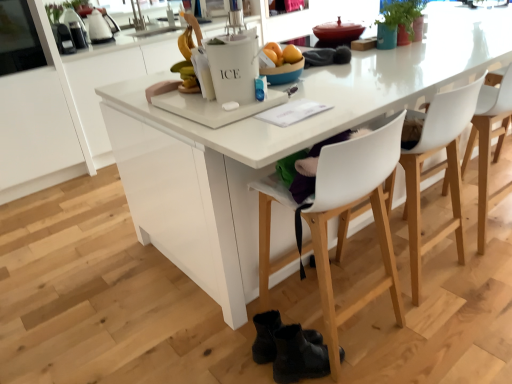
Describe the element at coordinates (233, 66) in the screenshot. I see `white plastic ice bucket at center` at that location.

The height and width of the screenshot is (384, 512). What do you see at coordinates (298, 356) in the screenshot?
I see `black leather boots at lower center, marked as the 2th footwear in a back-to-front arrangement` at bounding box center [298, 356].

In order to face black leather boots at lower center, acting as the first footwear starting from the back, should I rotate leftwards or rightwards?

You should rotate right by 3.871 degrees.

Locate an element on the screen. transparent glass window at upper left is located at coordinates (18, 38).

At what (x,y) coordinates should I click in order to perform the action: click on white plastic ice bucket at center. Please return your answer as a coordinate pair (x, y). Looking at the image, I should click on (233, 66).

Which is more to the right, black leather boots at lower center, marked as the 2th footwear in a back-to-front arrangement, or green matte plant at upper right?

Positioned to the right is green matte plant at upper right.

Looking at the image, does black leather boots at lower center, which is the 1th footwear from front to back, seem bigger or smaller compared to green matte plant at upper right?

black leather boots at lower center, which is the 1th footwear from front to back, is bigger than green matte plant at upper right.

Find the location of `plant above the black leather boots at lower center, which is the 1th footwear from front to back (from a real-world perspective)`. plant above the black leather boots at lower center, which is the 1th footwear from front to back (from a real-world perspective) is located at coordinates (403, 18).

Based on the photo, could you measure the distance between white plastic ice bucket at center and black leather boots at lower center, acting as the first footwear starting from the back?

They are 35.16 inches apart.

Would you say black leather boots at lower center, which is the 2th footwear from front to back, is part of white plastic ice bucket at center's contents?

No, black leather boots at lower center, which is the 2th footwear from front to back, is not inside white plastic ice bucket at center.

From the image's perspective, which is below, white plastic ice bucket at center or black leather boots at lower center, acting as the first footwear starting from the back?

From the image's view, black leather boots at lower center, acting as the first footwear starting from the back, is below.

Is white plastic ice bucket at center facing away from black leather boots at lower center, which is the 2th footwear from front to back?

No, white plastic ice bucket at center is not facing away from black leather boots at lower center, which is the 2th footwear from front to back.

From the image's perspective, does black leather boots at lower center, which is the 1th footwear from front to back, appear lower than black leather boots at lower center, which is the 2th footwear from front to back?

Yes.

Considering the relative positions of black leather boots at lower center, marked as the 2th footwear in a back-to-front arrangement, and black leather boots at lower center, acting as the first footwear starting from the back, in the image provided, is black leather boots at lower center, marked as the 2th footwear in a back-to-front arrangement, in front of black leather boots at lower center, acting as the first footwear starting from the back,?

Yes, it is in front of black leather boots at lower center, acting as the first footwear starting from the back.

Which object is positioned more to the right, black leather boots at lower center, which is the 1th footwear from front to back, or black leather boots at lower center, acting as the first footwear starting from the back?

black leather boots at lower center, which is the 1th footwear from front to back, is more to the right.

Does white plastic chair at right, which is the first chair from right to left, have a lesser height compared to black leather boots at lower center, acting as the first footwear starting from the back?

Incorrect, the height of white plastic chair at right, which is the first chair from right to left, does not fall short of that of black leather boots at lower center, acting as the first footwear starting from the back.

Is white plastic chair at right, which is the first chair from right to left, inside or outside of black leather boots at lower center, acting as the first footwear starting from the back?

white plastic chair at right, which is the first chair from right to left, is located beyond the bounds of black leather boots at lower center, acting as the first footwear starting from the back.

Is white plastic chair at right, which is the first chair from right to left, oriented away from black leather boots at lower center, acting as the first footwear starting from the back?

No, black leather boots at lower center, acting as the first footwear starting from the back, is not at the back of white plastic chair at right, which is the first chair from right to left.

Is white plastic chair at right, which is the first chair from right to left, further to camera compared to black leather boots at lower center, acting as the first footwear starting from the back?

Yes, white plastic chair at right, which is the first chair from right to left, is further from the viewer.

Does point (6, 26) lie behind point (252, 54)?

Yes, it is.

Is transparent glass window at upper left oriented away from white plastic ice bucket at center?

No, transparent glass window at upper left is not facing the opposite direction of white plastic ice bucket at center.

From the image's perspective, is transparent glass window at upper left on white plastic ice bucket at center?

Correct, transparent glass window at upper left appears higher than white plastic ice bucket at center in the image.

Which object is closer to the camera, white plastic chair at center, the 2th chair viewed from the left, or white plastic chair at right, which is the first chair from right to left?

white plastic chair at center, the 2th chair viewed from the left, is in front.

Can you tell me how much white plastic chair at center, the 2th chair viewed from the left, and white plastic chair at right, which is the first chair from right to left, differ in facing direction?

They differ by 1.85 degrees in their facing directions.

From a real-world perspective, which object stands above the other?

white plastic chair at right, acting as the third chair starting from the left, from a real-world perspective.

Can you confirm if black leather boots at lower center, which is the 1th footwear from front to back, is taller than transparent glass window at upper left?

In fact, black leather boots at lower center, which is the 1th footwear from front to back, may be shorter than transparent glass window at upper left.

Is black leather boots at lower center, which is the 1th footwear from front to back, at the left side of transparent glass window at upper left?

In fact, black leather boots at lower center, which is the 1th footwear from front to back, is to the right of transparent glass window at upper left.

Is black leather boots at lower center, marked as the 2th footwear in a back-to-front arrangement, touching transparent glass window at upper left?

They are not placed beside each other.

Identify the location of the 2nd footwear below the green matte plant at upper right (from the image's perspective). (298, 356).

Locate an element on the screen. The width and height of the screenshot is (512, 384). the 2nd footwear behind the white plastic ice bucket at center, counting from the anchor's position is located at coordinates (266, 336).

Which object lies nearer to the anchor point black leather boots at lower center, which is the 2th footwear from front to back, white plastic chair at center, which is counted as the 3th chair, starting from the right, or white plastic ice bucket at center?

white plastic chair at center, which is counted as the 3th chair, starting from the right, lies closer to black leather boots at lower center, which is the 2th footwear from front to back, than the other object.

Looking at this image, from the image, which object appears to be farther from black leather boots at lower center, which is the 1th footwear from front to back, transparent glass window at upper left or white plastic ice bucket at center?

transparent glass window at upper left lies further to black leather boots at lower center, which is the 1th footwear from front to back, than the other object.

Considering their positions, is black leather boots at lower center, acting as the first footwear starting from the back, positioned closer to white plastic chair at center, the 2th chair viewed from the left, than green matte plant at upper right?

The object closer to white plastic chair at center, the 2th chair viewed from the left, is black leather boots at lower center, acting as the first footwear starting from the back.

Estimate the real-world distances between objects in this image. Which object is closer to black leather boots at lower center, which is the 1th footwear from front to back, white plastic chair at center, which is counted as the 3th chair, starting from the right, or white plastic chair at right, which is the first chair from right to left?

Among the two, white plastic chair at center, which is counted as the 3th chair, starting from the right, is located nearer to black leather boots at lower center, which is the 1th footwear from front to back.

When comparing their distances from green matte plant at upper right, does white plastic chair at center, which is the 1th chair in left-to-right order, or transparent glass window at upper left seem closer?

Based on the image, white plastic chair at center, which is the 1th chair in left-to-right order, appears to be nearer to green matte plant at upper right.

Looking at the image, which one is located further to black leather boots at lower center, acting as the first footwear starting from the back, white plastic ice bucket at center or green matte plant at upper right?

Based on the image, green matte plant at upper right appears to be further to black leather boots at lower center, acting as the first footwear starting from the back.

When comparing their distances from black leather boots at lower center, marked as the 2th footwear in a back-to-front arrangement, does transparent glass window at upper left or white plastic chair at center, which is counted as the 3th chair, starting from the right, seem further?

The object further to black leather boots at lower center, marked as the 2th footwear in a back-to-front arrangement, is transparent glass window at upper left.

When comparing their distances from white plastic ice bucket at center, does black leather boots at lower center, marked as the 2th footwear in a back-to-front arrangement, or green matte plant at upper right seem further?

green matte plant at upper right is positioned further to the anchor white plastic ice bucket at center.

Identify the location of footwear between black leather boots at lower center, acting as the first footwear starting from the back, and white plastic chair at right, acting as the third chair starting from the left, in the horizontal direction. (298, 356).

Identify the location of appliance between transparent glass window at upper left and white plastic chair at center, the 2th chair viewed from the left, in the horizontal direction. (233, 66).

Locate an element on the screen. chair situated between transparent glass window at upper left and white plastic chair at center, the 2th chair viewed from the left, from left to right is located at coordinates (348, 218).

Find the location of a particular element. chair between white plastic chair at center, the 2th chair viewed from the left, and black leather boots at lower center, acting as the first footwear starting from the back, from top to bottom is located at coordinates (x=348, y=218).